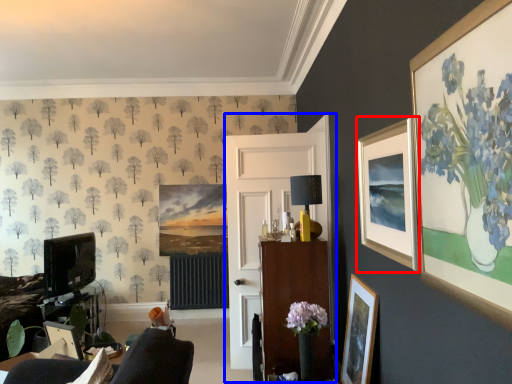
Question: Which object appears farthest to the camera in this image, picture frame (highlighted by a red box) or side (highlighted by a blue box)?

Choices:
 (A) picture frame
 (B) side

Answer: (B)